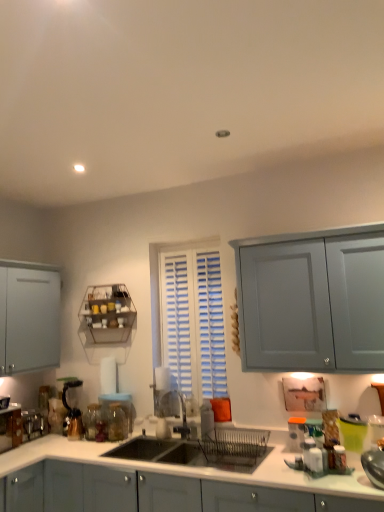
Locate an element on the screen. The height and width of the screenshot is (512, 384). free spot to the right of metallic silver toaster at lower left, which appears as the 1th appliance when viewed from the back is located at coordinates (49, 440).